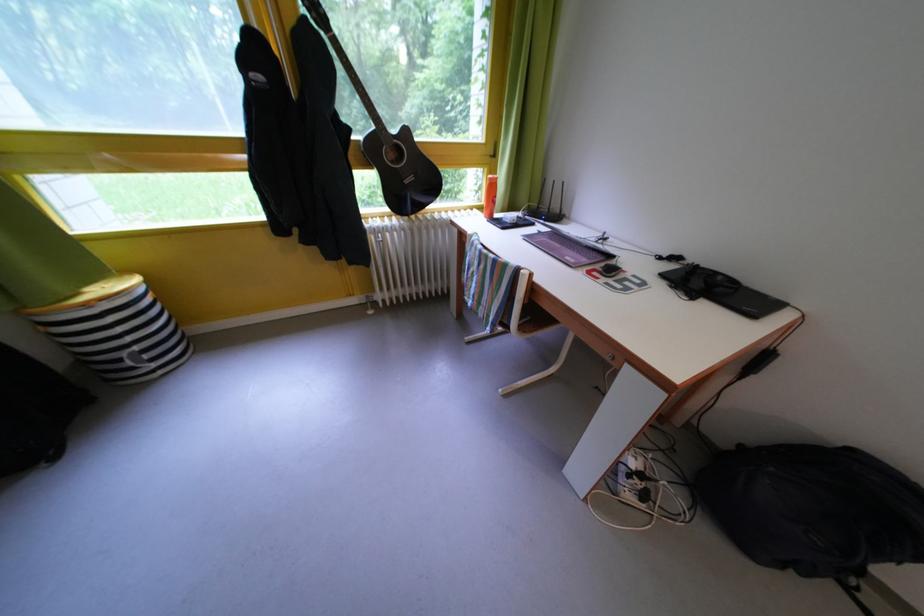
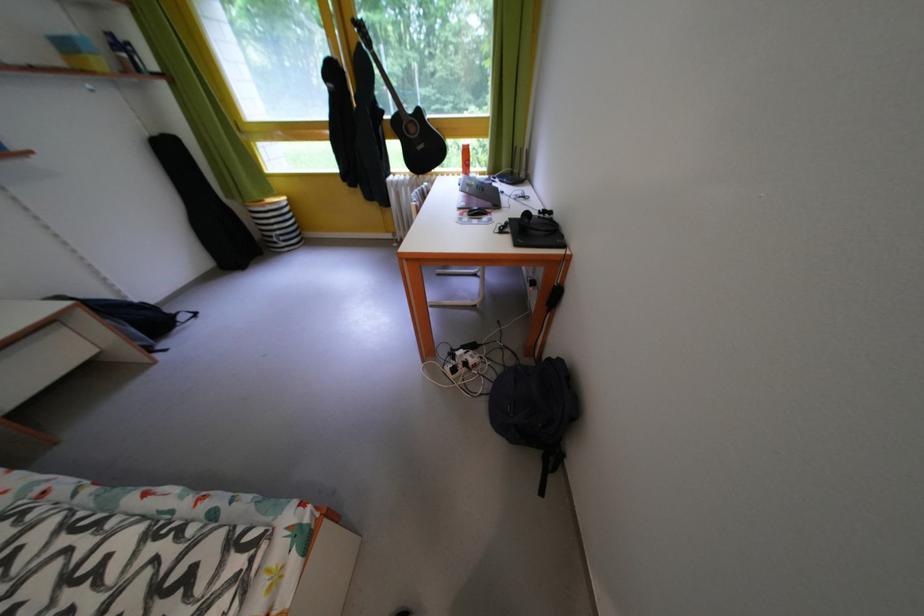
Find the pixel in the second image that matches point 147,354 in the first image.

(287, 238)